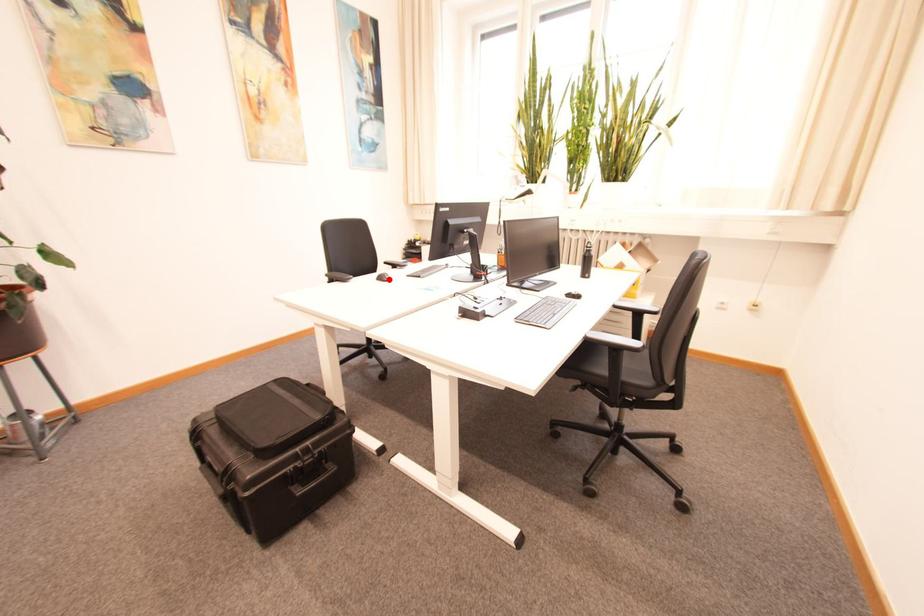
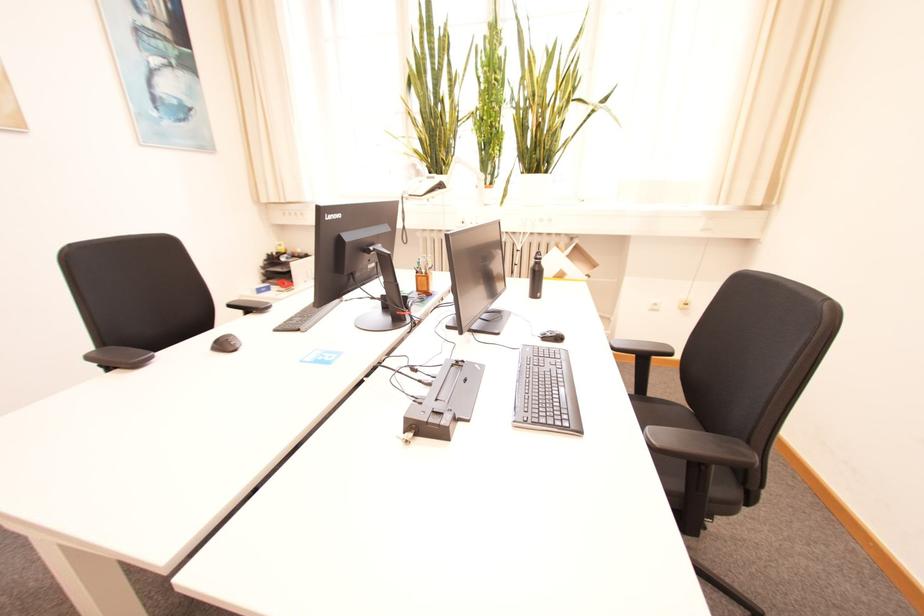
Locate, in the second image, the point that corresponds to the highlighted location in the first image.

(229, 346)